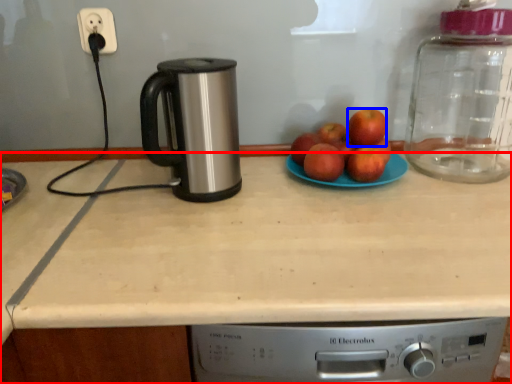
Question: Which of the following is the farthest to the observer, countertop (highlighted by a red box) or apple (highlighted by a blue box)?

Choices:
 (A) countertop
 (B) apple

Answer: (B)